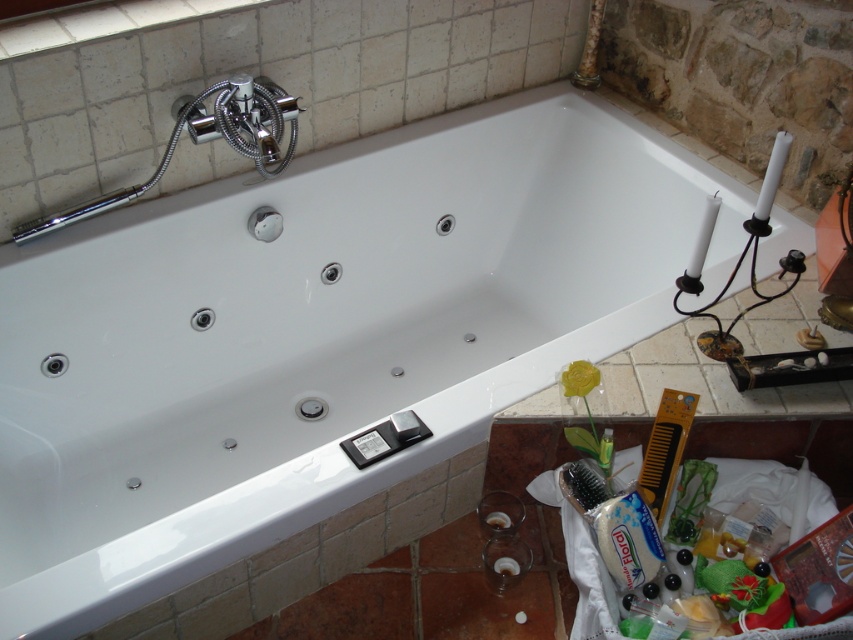
You are standing in the bathroom and see two points marked in the scene. Which point is closer to you, point (277, 131) or point (683, 444)?

Point (683, 444) is closer to you because point (277, 131) is behind it.